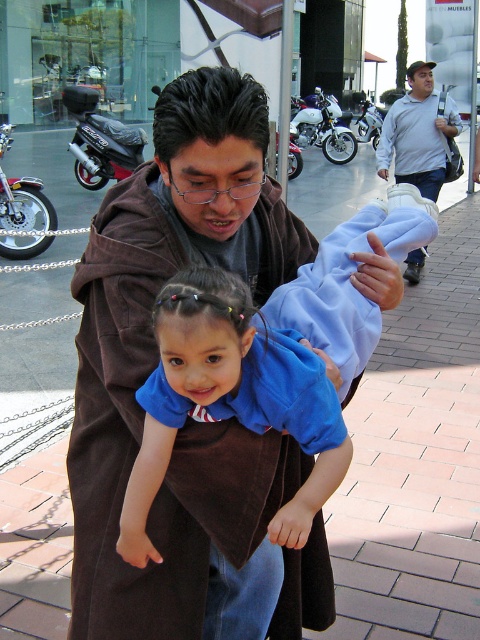
The height and width of the screenshot is (640, 480). In order to click on blue cotton shirt at center in this screenshot , I will do `click(240, 420)`.

Is blue cotton shirt at center above white matte motorcycle at center?

No.

Does point (326, 401) come closer to viewer compared to point (325, 157)?

Yes, point (326, 401) is closer to viewer.

Locate an element on the screen. This screenshot has width=480, height=640. blue cotton shirt at center is located at coordinates (240, 420).

Is blue cotton shirt at center further to the viewer compared to silver metallic motorcycle at center?

That is False.

Describe the element at coordinates (240, 420) in the screenshot. This screenshot has height=640, width=480. I see `blue cotton shirt at center` at that location.

What do you see at coordinates (240, 420) in the screenshot?
I see `blue cotton shirt at center` at bounding box center [240, 420].

Where is `blue cotton shirt at center`? This screenshot has height=640, width=480. blue cotton shirt at center is located at coordinates [240, 420].

Between white matte motorcycle at center and silver metallic motorcycle at center, which one is positioned lower?

white matte motorcycle at center

Can you confirm if white matte motorcycle at center is positioned below silver metallic motorcycle at center?

Correct, white matte motorcycle at center is located below silver metallic motorcycle at center.

Measure the distance between white matte motorcycle at center and camera.

white matte motorcycle at center and camera are 14.76 meters apart.

What are the coordinates of `white matte motorcycle at center` in the screenshot? It's located at (323, 125).